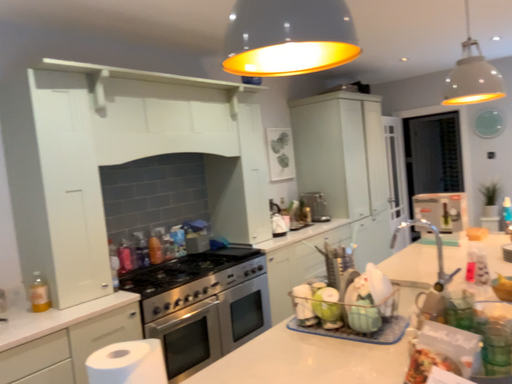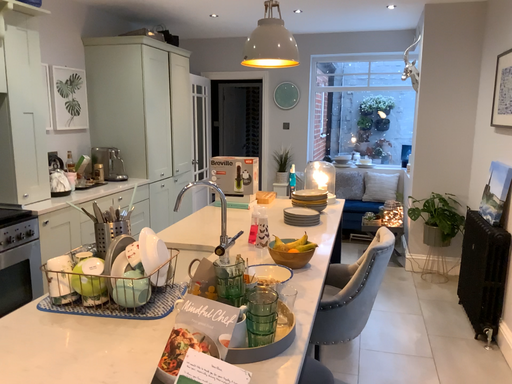
Question: How did the camera likely rotate when shooting the video?

Choices:
 (A) rotated left
 (B) rotated right

Answer: (B)